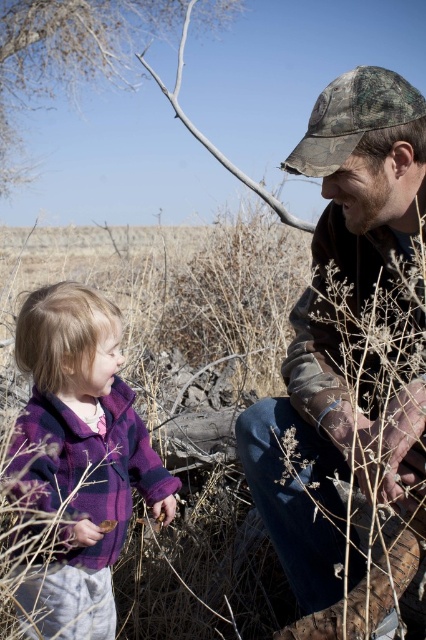
You are a photographer trying to capture a candid shot of both the camouflage fabric hat at upper right and the purple fleece jacket at left in the same frame. Based on their positions and heights, which object should you focus on first to ensure both are in the frame?

The camouflage fabric hat at upper right is taller than the purple fleece jacket at left, so you should focus on the camouflage fabric hat at upper right first to ensure both are in the frame.